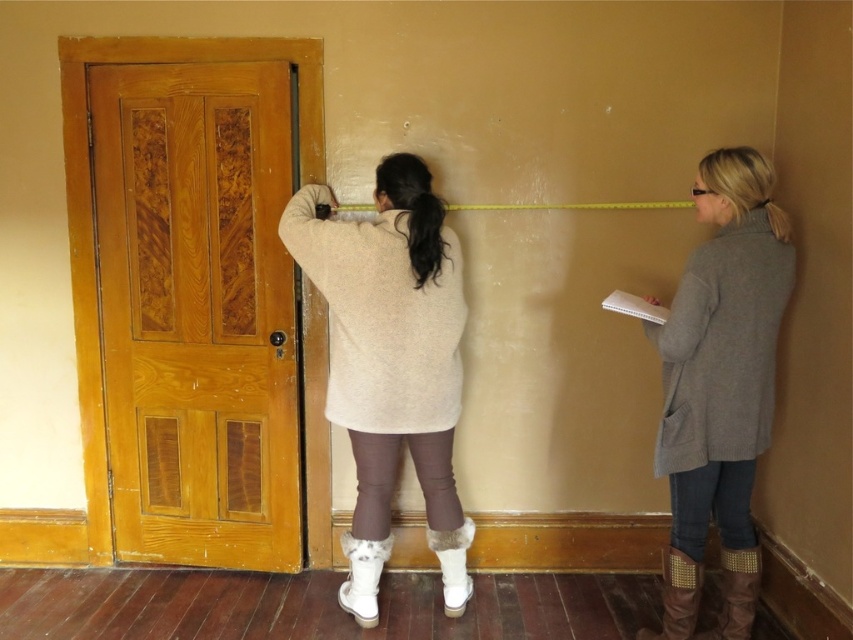
Question: Does brown studded boot at lower right appear on the left side of white fuzzy boot at lower center?

Choices:
 (A) yes
 (B) no

Answer: (B)

Question: Which object is the closest to the white fuzzy boot at lower center?

Choices:
 (A) beige woolen sweater at center
 (B) white fur boot at lower center
 (C) brown leather boot at lower right
 (D) brown leather pants at center

Answer: (D)

Question: Which point is closer to the camera?

Choices:
 (A) click(x=428, y=451)
 (B) click(x=683, y=563)
 (C) click(x=752, y=573)

Answer: (B)

Question: Which object appears farthest from the camera in this image?

Choices:
 (A) brown leather boot at lower right
 (B) white fuzzy boot at lower center

Answer: (B)

Question: Can you confirm if brown leather pants at center is positioned below white fur boot at lower center?

Choices:
 (A) yes
 (B) no

Answer: (B)

Question: Does brown leather pants at center have a smaller size compared to brown leather boot at lower right?

Choices:
 (A) yes
 (B) no

Answer: (B)